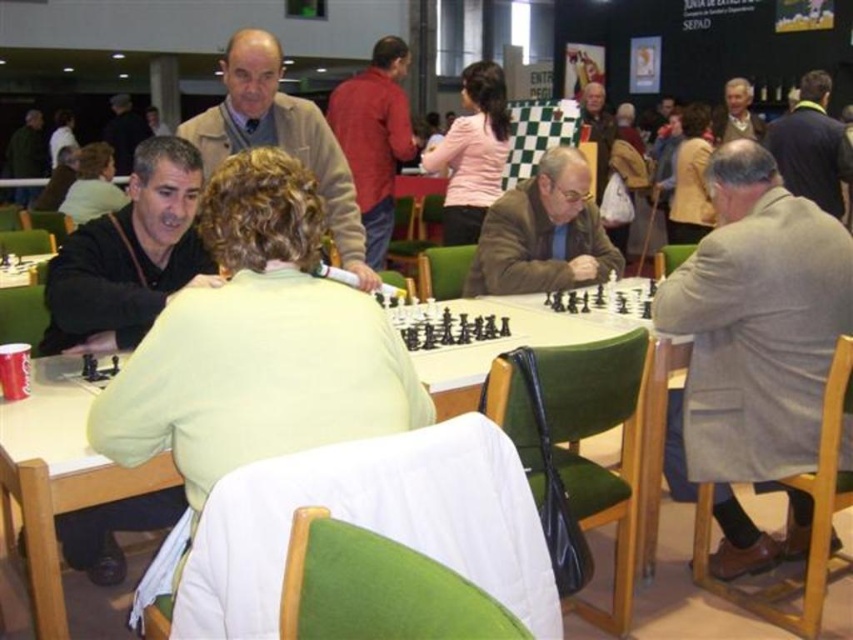
Can you confirm if gray woolen coat at right is wider than light brown leather jacket at upper right?

Yes, gray woolen coat at right is wider than light brown leather jacket at upper right.

Who is more distant from viewer, (698, 337) or (751, 136)?

The point (751, 136) is more distant.

You are a GUI agent. You are given a task and a screenshot of the screen. Output one action in this format:
    pyautogui.click(x=<x>, y=<y>)
    Task: Click on the gray woolen coat at right
    The image size is (853, 640).
    Given the screenshot: What is the action you would take?
    pyautogui.click(x=753, y=348)

Does black matte jacket at left have a lesser height compared to dark green jacket at upper left?

Yes, black matte jacket at left is shorter than dark green jacket at upper left.

Is point (86, 301) positioned after point (28, 176)?

That is False.

Find the location of `black matte jacket at left`. black matte jacket at left is located at coordinates (129, 257).

Can you confirm if light brown wool sweater at center is taller than black plastic chess set at center?

Correct, light brown wool sweater at center is much taller as black plastic chess set at center.

Is point (236, 29) less distant than point (474, 328)?

No.

The width and height of the screenshot is (853, 640). What are the coordinates of `light brown wool sweater at center` in the screenshot? It's located at (280, 138).